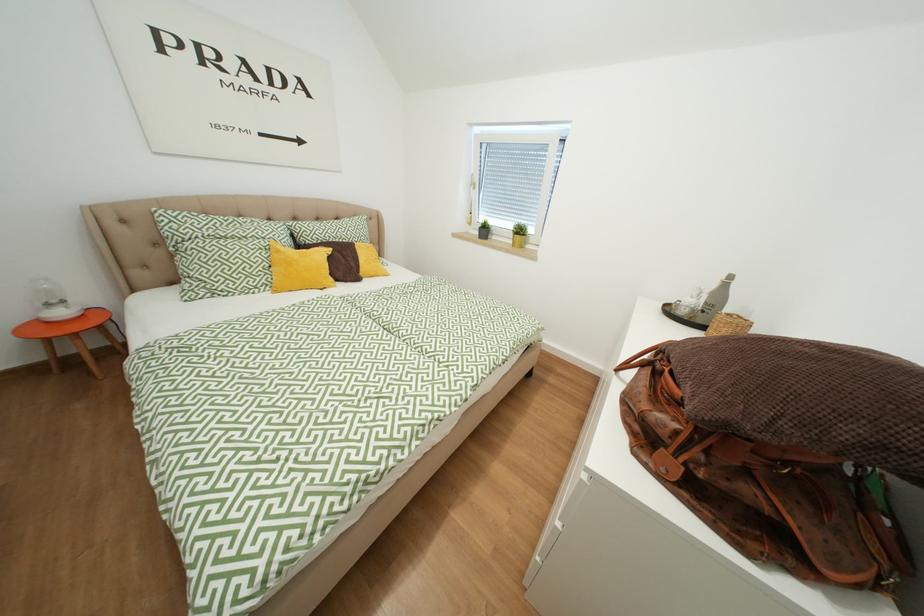
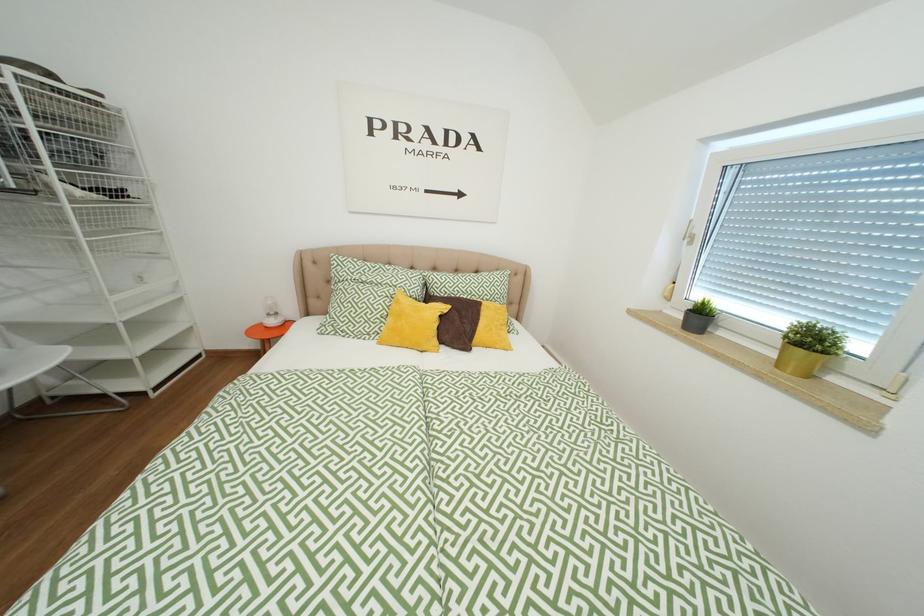
Question: How did the camera likely rotate?

Choices:
 (A) Left
 (B) Right
 (C) Up
 (D) Down

Answer: (A)